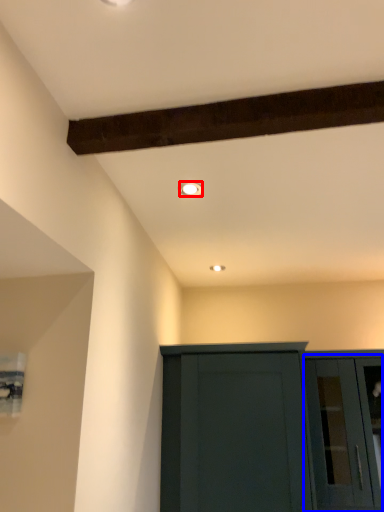
Question: Which object is closer to the camera taking this photo, lighting (highlighted by a red box) or glass door (highlighted by a blue box)?

Choices:
 (A) lighting
 (B) glass door

Answer: (A)